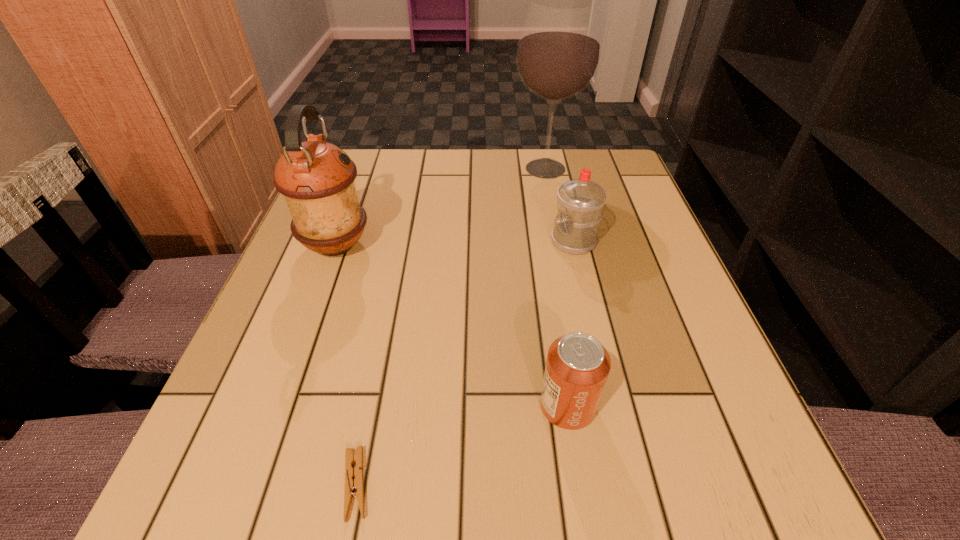
Locate an element on the screen. water bottle at the right edge is located at coordinates (580, 202).

The image size is (960, 540). What are the coordinates of `object located at the far right corner` in the screenshot? It's located at (559, 50).

Where is `free location at the far edge of the desktop`? free location at the far edge of the desktop is located at coordinates (399, 163).

What are the coordinates of `vacant space at the near edge of the desktop` in the screenshot? It's located at (409, 482).

The height and width of the screenshot is (540, 960). Identify the location of vacant space at the left edge. click(x=301, y=312).

The image size is (960, 540). In the image, there is a desktop. Find the location of `vacant space at the right edge`. vacant space at the right edge is located at coordinates (629, 366).

In the image, there is a desktop. Identify the location of vacant space at the far left corner. The width and height of the screenshot is (960, 540). (359, 172).

The height and width of the screenshot is (540, 960). Identify the location of blank space at the near left corner of the desktop. (291, 486).

Where is `free space at the far right corner`? free space at the far right corner is located at coordinates click(x=598, y=160).

Find the location of a particular element. This screenshot has width=960, height=540. vacant area that lies between the oil lamp and the third shortest object is located at coordinates (455, 243).